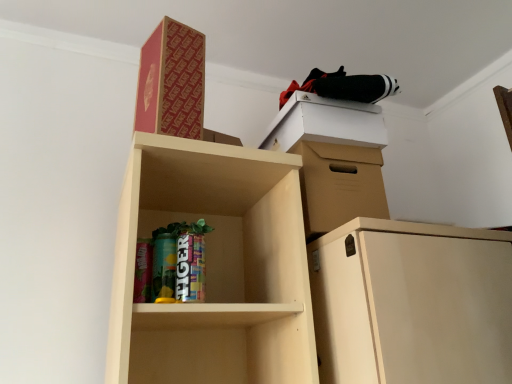
Question: Can you confirm if white cardboard box at upper right is positioned to the right of red cardboard box at upper center?

Choices:
 (A) yes
 (B) no

Answer: (A)

Question: Is white cardboard box at upper right bigger than red cardboard box at upper center?

Choices:
 (A) no
 (B) yes

Answer: (B)

Question: Is white cardboard box at upper right turned away from red cardboard box at upper center?

Choices:
 (A) yes
 (B) no

Answer: (B)

Question: Is the depth of white cardboard box at upper right greater than that of red cardboard box at upper center?

Choices:
 (A) no
 (B) yes

Answer: (B)

Question: From the image's perspective, is white cardboard box at upper right over red cardboard box at upper center?

Choices:
 (A) no
 (B) yes

Answer: (A)

Question: From the image's perspective, is white cardboard box at upper right located beneath red cardboard box at upper center?

Choices:
 (A) no
 (B) yes

Answer: (B)

Question: Does red cardboard box at upper center come in front of white cardboard box at upper right?

Choices:
 (A) yes
 (B) no

Answer: (A)

Question: Can you confirm if red cardboard box at upper center is smaller than white cardboard box at upper right?

Choices:
 (A) yes
 (B) no

Answer: (A)

Question: Can you confirm if red cardboard box at upper center is wider than white cardboard box at upper right?

Choices:
 (A) yes
 (B) no

Answer: (B)

Question: From a real-world perspective, is red cardboard box at upper center under white cardboard box at upper right?

Choices:
 (A) yes
 (B) no

Answer: (B)

Question: From the image's perspective, is red cardboard box at upper center on top of white cardboard box at upper right?

Choices:
 (A) no
 (B) yes

Answer: (B)

Question: Is red cardboard box at upper center behind white cardboard box at upper right?

Choices:
 (A) yes
 (B) no

Answer: (B)

Question: Considering their positions, is red cardboard box at upper center located in front of or behind white cardboard box at upper right?

Choices:
 (A) behind
 (B) front

Answer: (B)